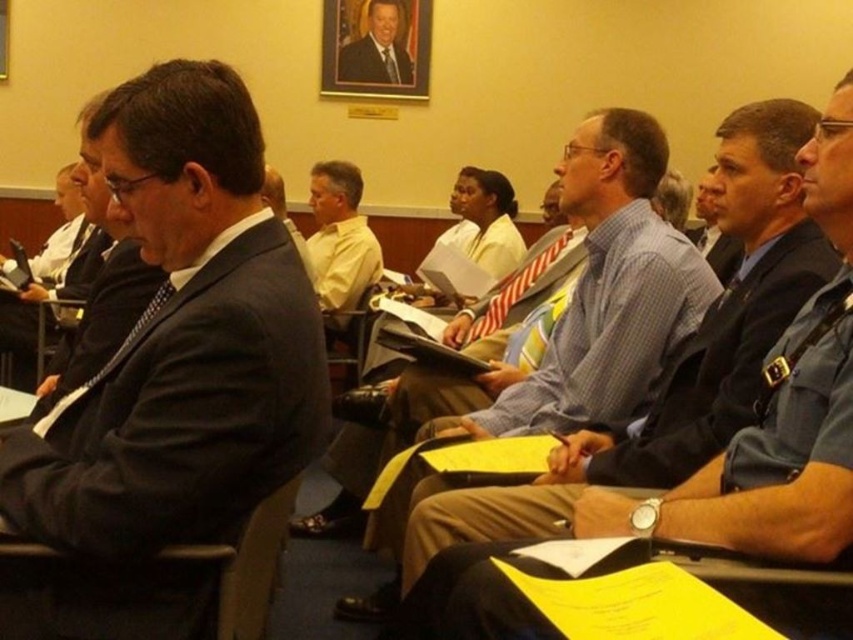
Question: Does dark gray fabric chair at center appear on the left side of blue uniform shirt at center?

Choices:
 (A) yes
 (B) no

Answer: (A)

Question: Considering the relative positions of light blue checkered shirt at center and dark gray fabric chair at center in the image provided, where is light blue checkered shirt at center located with respect to dark gray fabric chair at center?

Choices:
 (A) left
 (B) right

Answer: (B)

Question: Based on their relative distances, which object is farther from the matte black suit at center?

Choices:
 (A) light blue checkered shirt at center
 (B) blue uniform shirt at center

Answer: (B)

Question: Is matte black suit at left to the right of blue checkered shirt at center from the viewer's perspective?

Choices:
 (A) yes
 (B) no

Answer: (B)

Question: Which point is closer to the camera taking this photo?

Choices:
 (A) (263, 428)
 (B) (805, 500)
 (C) (372, 51)

Answer: (B)

Question: Which object is farther from the camera taking this photo?

Choices:
 (A) matte black suit at left
 (B) yellow shirt at center
 (C) blue uniform shirt at center

Answer: (B)